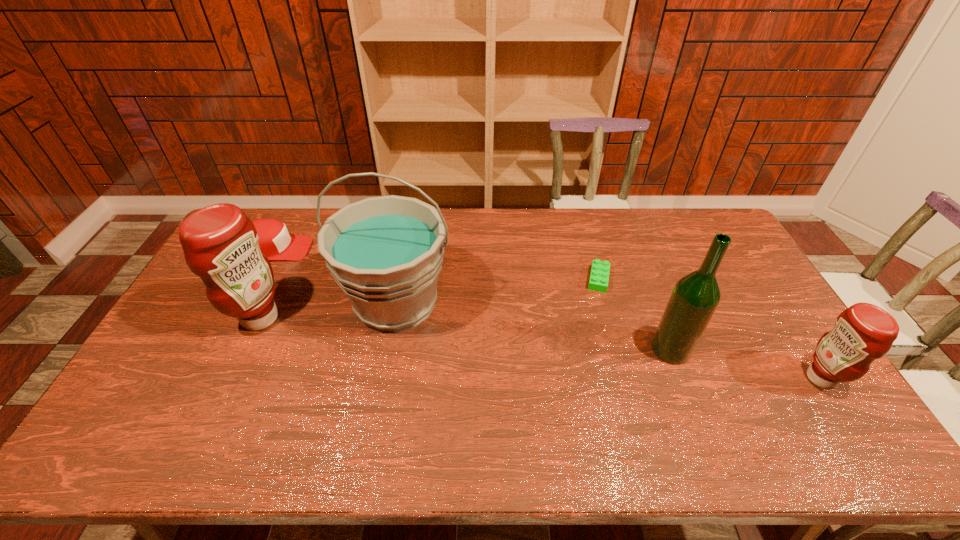
I want to click on the farther condiment, so coord(220,243).

Identify the location of the left condiment. (220, 243).

Find the location of a particular element. This screenshot has width=960, height=540. the nearer condiment is located at coordinates (864, 332).

At what (x,y) coordinates should I click in order to perform the action: click on the right condiment. Please return your answer as a coordinate pair (x, y). Looking at the image, I should click on pyautogui.click(x=864, y=332).

At what (x,y) coordinates should I click in order to perform the action: click on the shortest object. Please return your answer as a coordinate pair (x, y). This screenshot has width=960, height=540. Looking at the image, I should click on (599, 275).

You are a GUI agent. You are given a task and a screenshot of the screen. Output one action in this format:
    pyautogui.click(x=<x>, y=<y>)
    Task: Click on the third object from right to left
    The image size is (960, 540).
    Given the screenshot: What is the action you would take?
    pos(599,275)

Where is `bucket`? This screenshot has height=540, width=960. bucket is located at coordinates (386, 252).

Locate an element on the screen. This screenshot has height=540, width=960. the second shortest object is located at coordinates (274, 241).

Where is `baseball cap`? baseball cap is located at coordinates (274, 241).

Find the location of a particular element. The image size is (960, 540). the second object from right to left is located at coordinates (695, 297).